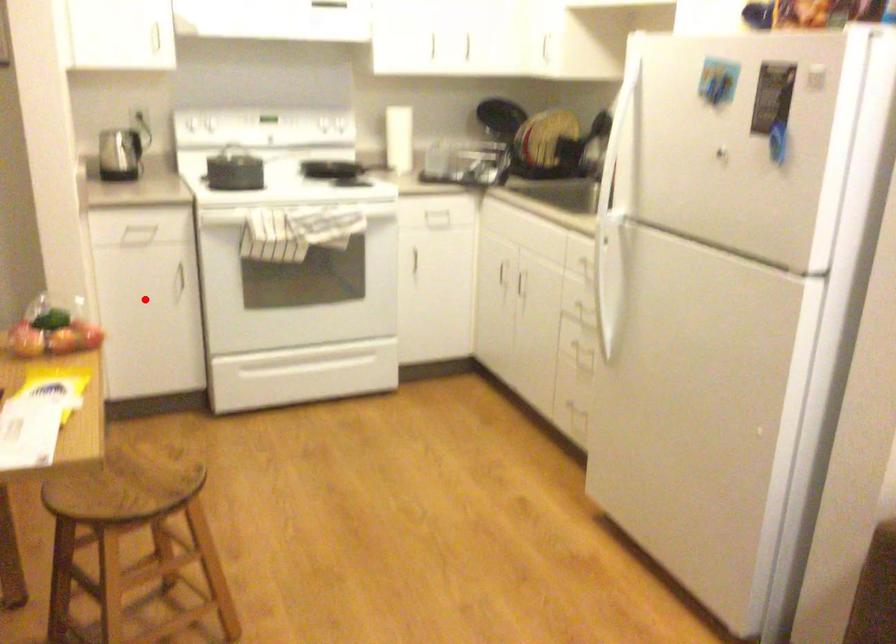
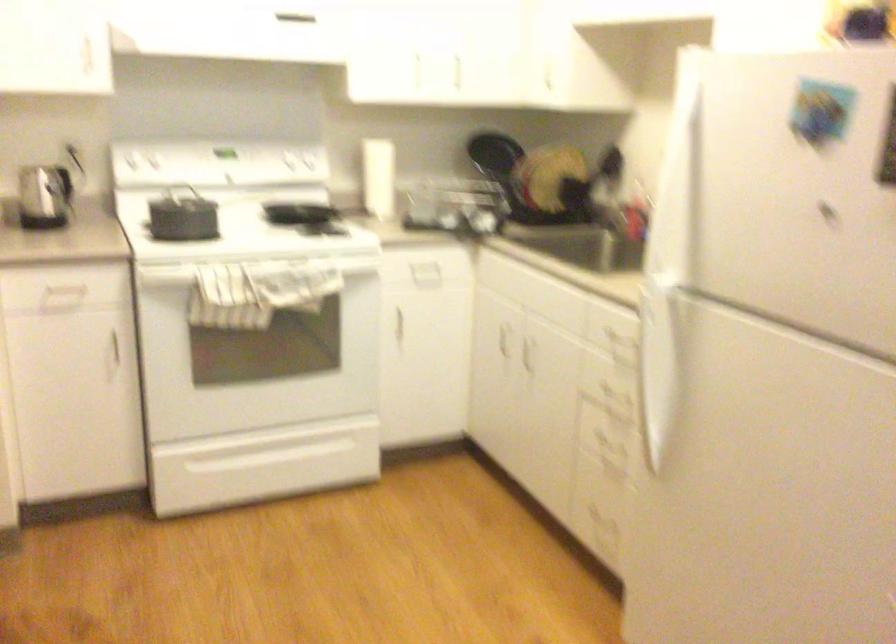
In the second image, find the point that corresponds to the highlighted location in the first image.

(73, 379)